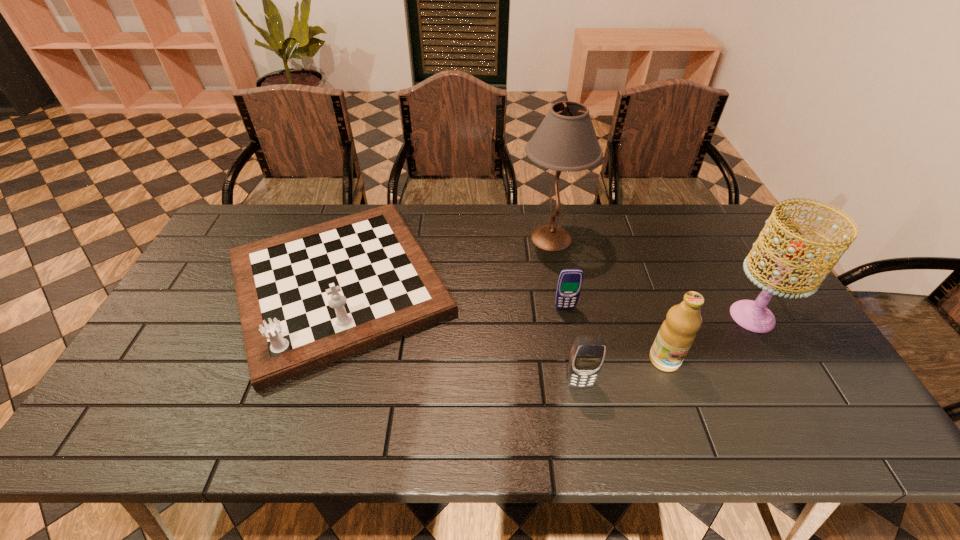
Locate an element on the screen. The width and height of the screenshot is (960, 540). object at the right edge is located at coordinates (754, 316).

The height and width of the screenshot is (540, 960). Identify the location of object that is at the far left corner. [308, 298].

Locate an element on the screen. Image resolution: width=960 pixels, height=540 pixels. vacant space at the far edge is located at coordinates (492, 246).

In order to click on vacant space at the near edge of the desktop in this screenshot , I will do `click(609, 410)`.

Locate an element on the screen. The image size is (960, 540). vacant space at the left edge of the desktop is located at coordinates (182, 334).

This screenshot has width=960, height=540. Identify the location of vacant region at the far right corner of the desktop. (689, 223).

What are the coordinates of `vacant space in between the table lamp and the lampshade` in the screenshot? It's located at (652, 278).

You are a GUI agent. You are given a task and a screenshot of the screen. Output one action in this format:
    pyautogui.click(x=<x>, y=<y>)
    Task: Click on the free space between the third tallest object and the shortest object
    
    Given the screenshot: What is the action you would take?
    pyautogui.click(x=614, y=334)

The height and width of the screenshot is (540, 960). Identify the location of vacant region between the nearer cellular telephone and the tallest object. (565, 310).

Locate an element on the screen. This screenshot has width=960, height=540. free space between the shortest object and the olive oil is located at coordinates (614, 334).